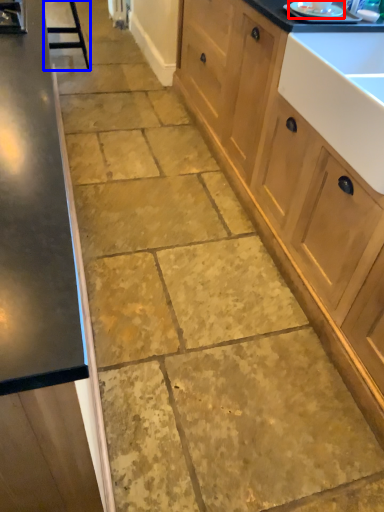
Question: Which point is further to the camera, appliance (highlighted by a red box) or bar stool (highlighted by a blue box)?

Choices:
 (A) appliance
 (B) bar stool

Answer: (B)